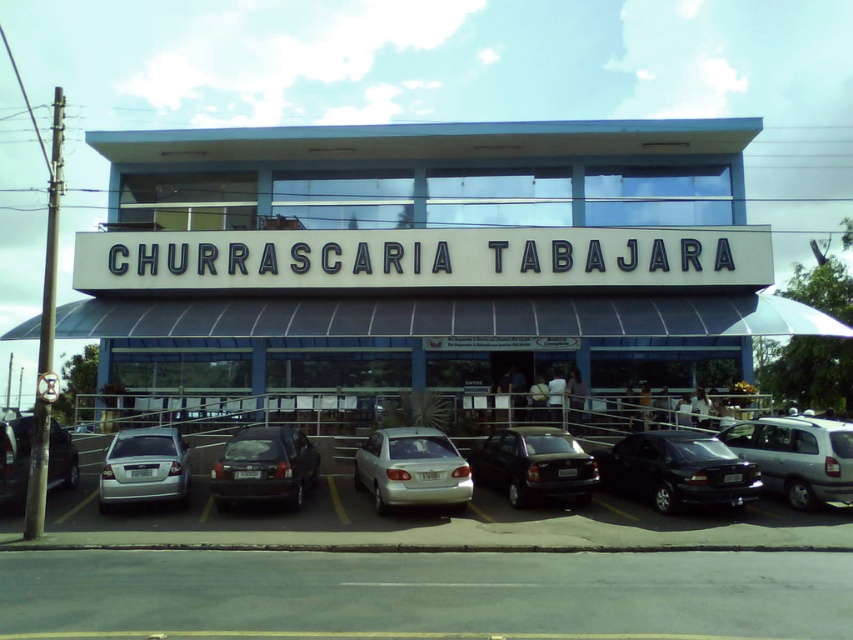
Which of these two, blue glass building at center or silver metallic sedan at center, stands shorter?

silver metallic sedan at center

This screenshot has width=853, height=640. What do you see at coordinates (415, 252) in the screenshot?
I see `blue glass building at center` at bounding box center [415, 252].

Is point (177, 252) closer to camera compared to point (467, 490)?

No, it is behind (467, 490).

Where is `blue glass building at center`? This screenshot has width=853, height=640. blue glass building at center is located at coordinates (415, 252).

Is dark gray metallic sedan at center bigger than silver metallic sedan at left?

Indeed, dark gray metallic sedan at center has a larger size compared to silver metallic sedan at left.

Between point (584, 472) and point (4, 456), which one is positioned behind?

Positioned behind is point (584, 472).

At what (x,y) coordinates should I click in order to perform the action: click on dark gray metallic sedan at center. Please return your answer as a coordinate pair (x, y). The height and width of the screenshot is (640, 853). Looking at the image, I should click on (534, 465).

Identify the location of dark gray metallic sedan at center. (534, 465).

Between silver metallic sedan at center and dark gray metallic sedan at center, which one has more height?

silver metallic sedan at center is taller.

Is the position of silver metallic sedan at center more distant than that of dark gray metallic sedan at center?

No.

Does point (373, 456) lie in front of point (502, 481)?

Yes, it is.

Locate an element on the screen. This screenshot has height=640, width=853. silver metallic sedan at center is located at coordinates (410, 468).